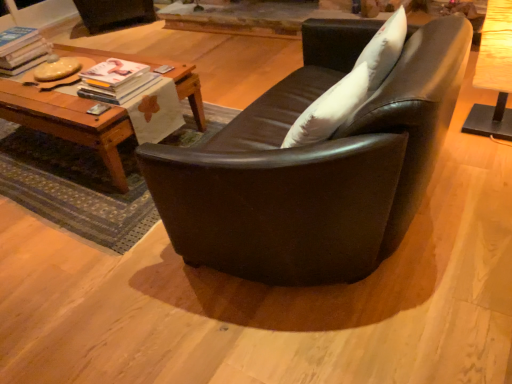
This screenshot has width=512, height=384. Find the location of `free location in front of wooden table at right, acting as the 1th table starting from the right`. free location in front of wooden table at right, acting as the 1th table starting from the right is located at coordinates (490, 153).